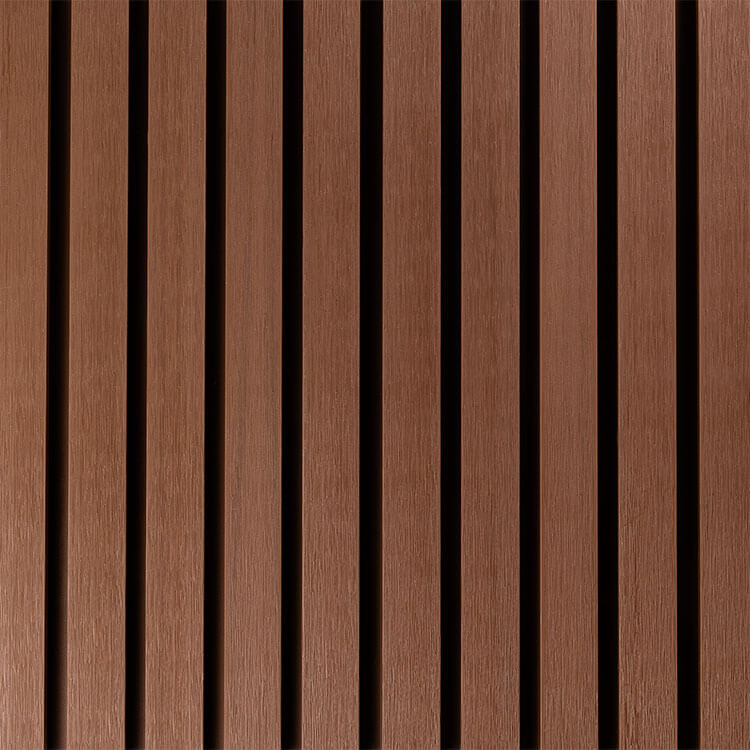
Where is `wood slats`? wood slats is located at coordinates (33, 568), (78, 573), (168, 572), (264, 572), (310, 570), (404, 564), (487, 562), (565, 558), (682, 567), (706, 564).